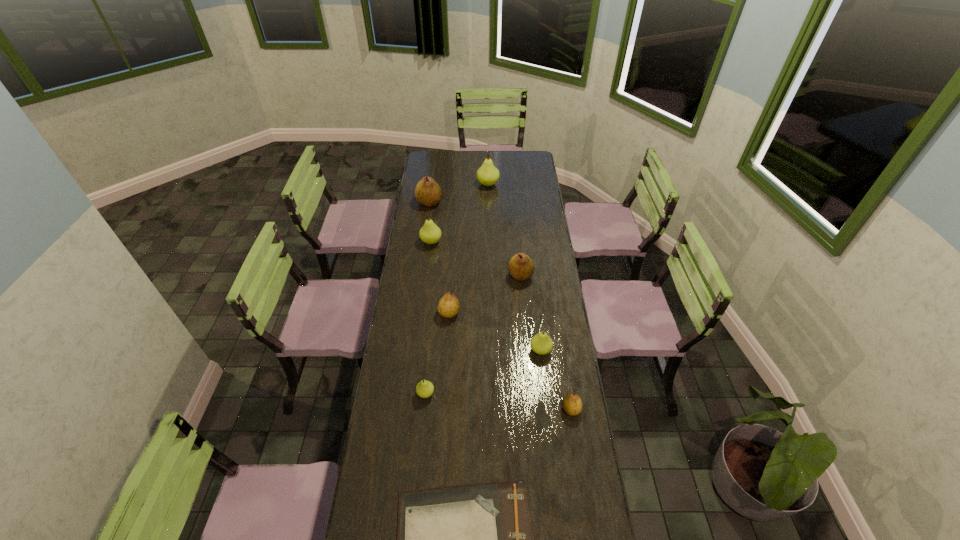
Select which green pear is the second closest to the third smallest green pear. Please provide its 2D coordinates. Your answer should be formatted as a tuple, i.e. [(x, y)], where the tuple contains the x and y coordinates of a point satisfying the conditions above.

[(541, 343)]

Identify the location of green pear identified as the fourth closest to the nearest object. (487, 174).

Find the location of a particular element. The image size is (960, 540). the closest brown pear to the fifth pear from left to right is located at coordinates (427, 192).

Where is `brown pear that is the closest to the third farthest brown pear`? The image size is (960, 540). brown pear that is the closest to the third farthest brown pear is located at coordinates (521, 268).

Locate an element on the screen. vacant space that satisfies the following two spatial constraints: 1. on the front side of the seventh nearest pear; 2. on the right side of the third brown pear from left to right is located at coordinates (420, 275).

You are a GUI agent. You are given a task and a screenshot of the screen. Output one action in this format:
    pyautogui.click(x=<x>, y=<y>)
    Task: Click on the free region that satisfies the following two spatial constraints: 1. on the back side of the farthest green pear; 2. on the right side of the second farthest pear
    Image resolution: width=960 pixels, height=540 pixels.
    Given the screenshot: What is the action you would take?
    pyautogui.click(x=432, y=184)

The image size is (960, 540). I want to click on free space that satisfies the following two spatial constraints: 1. on the back side of the rightmost green pear; 2. on the left side of the nearest green pear, so click(430, 350).

Identify the location of free location that satisfies the following two spatial constraints: 1. on the back side of the nearest green pear; 2. on the left side of the fifth farthest object. Image resolution: width=960 pixels, height=540 pixels. (433, 313).